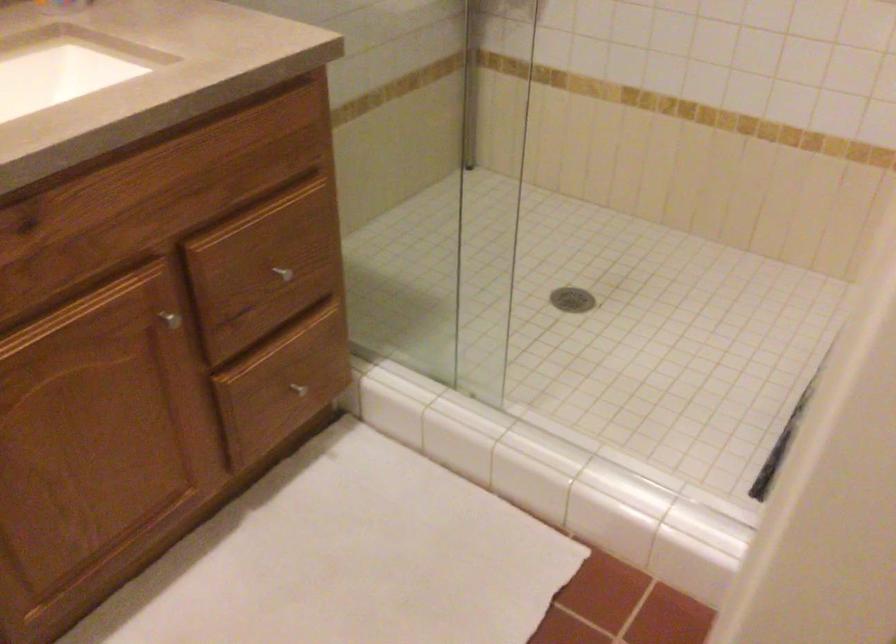
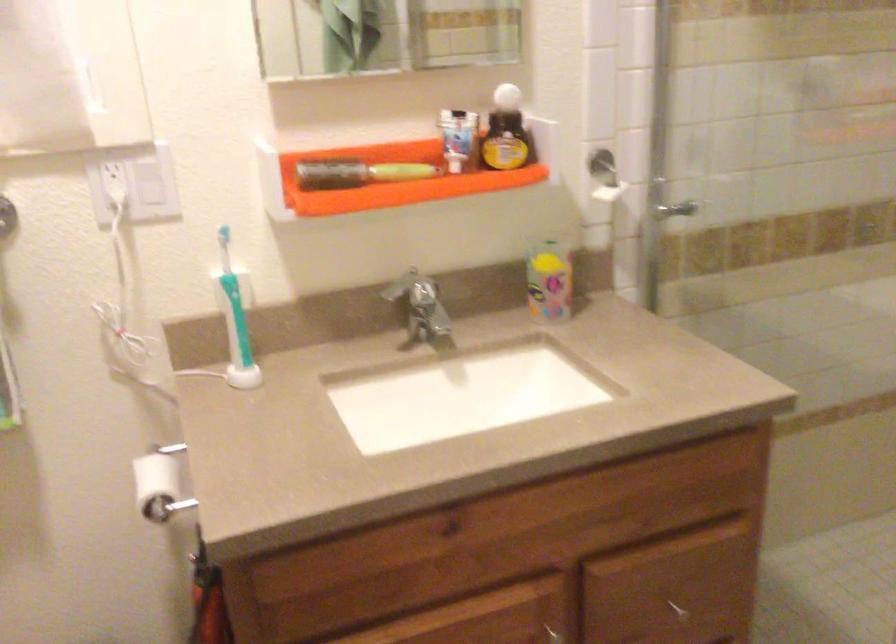
The point at [177,327] is marked in the first image. Where is the corresponding point in the second image?

(555, 635)